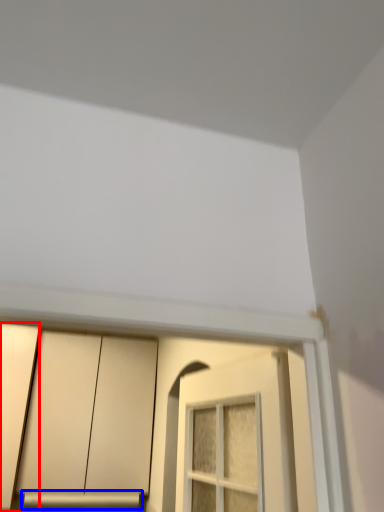
Question: Which object appears closest to the camera in this image, door (highlighted by a red box) or window sill (highlighted by a blue box)?

Choices:
 (A) door
 (B) window sill

Answer: (A)